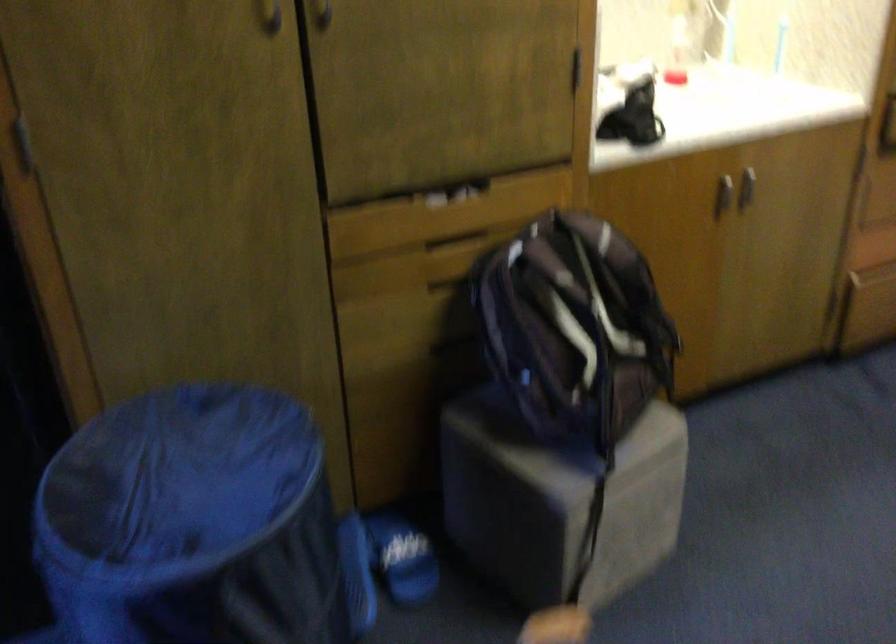
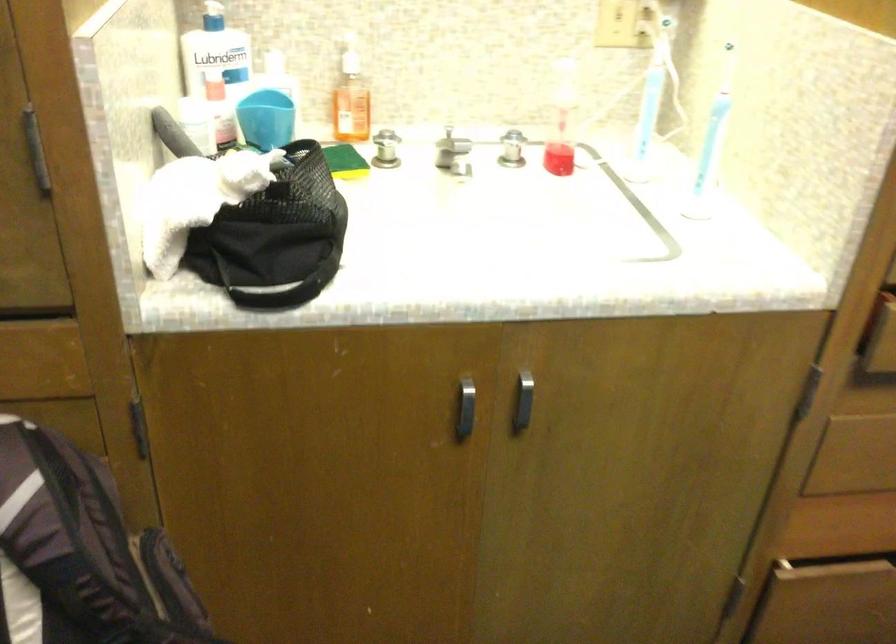
Where in the second image is the point corresponding to (x=653, y=75) from the first image?

(512, 149)